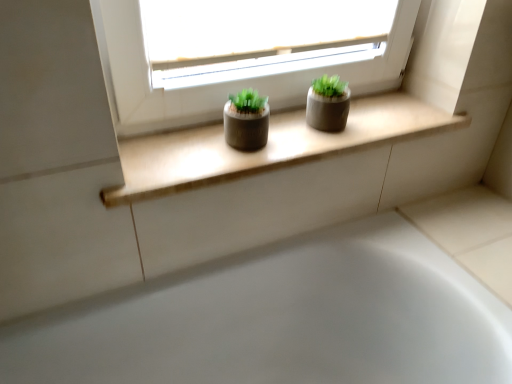
Question: Do you think matte concrete window sill at center is within white glossy bathtub at lower center, or outside of it?

Choices:
 (A) outside
 (B) inside

Answer: (A)

Question: Is matte concrete window sill at center in front of or behind white glossy bathtub at lower center in the image?

Choices:
 (A) behind
 (B) front

Answer: (A)

Question: Is matte concrete window sill at center bigger or smaller than white glossy bathtub at lower center?

Choices:
 (A) small
 (B) big

Answer: (A)

Question: Is white glossy bathtub at lower center inside the boundaries of matte concrete window sill at center, or outside?

Choices:
 (A) outside
 (B) inside

Answer: (A)

Question: Is point (344, 301) positioned closer to the camera than point (353, 119)?

Choices:
 (A) closer
 (B) farther

Answer: (B)

Question: In terms of size, does white glossy bathtub at lower center appear bigger or smaller than matte concrete window sill at center?

Choices:
 (A) small
 (B) big

Answer: (B)

Question: From a real-world perspective, is white glossy bathtub at lower center above or below matte concrete window sill at center?

Choices:
 (A) above
 (B) below

Answer: (B)